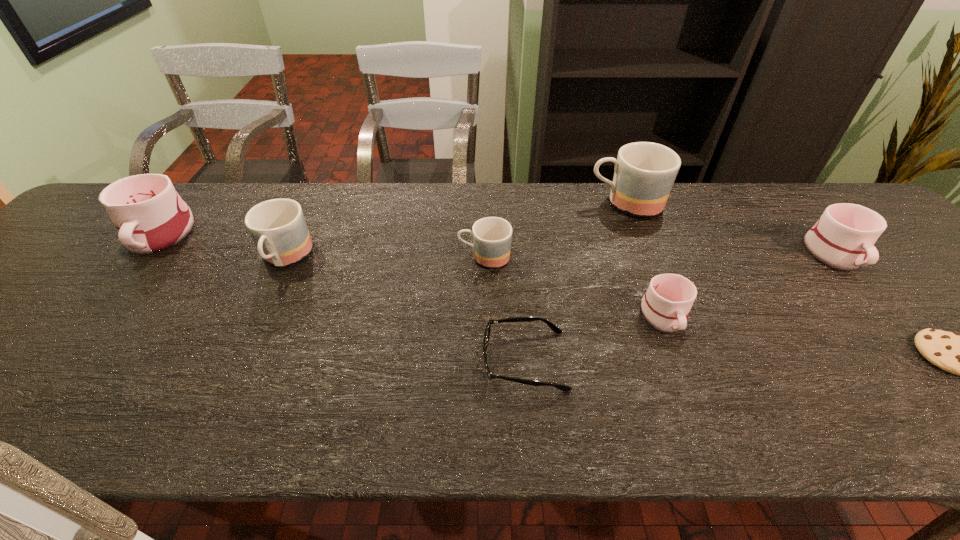
The height and width of the screenshot is (540, 960). I want to click on object that stands as the fourth closest to the second shortest object, so click(x=278, y=228).

This screenshot has height=540, width=960. Identify the location of the third closest mug to the second white mug from left to right. (843, 238).

Locate an element on the screen. The width and height of the screenshot is (960, 540). mug that stands as the fourth closest to the second smallest white mug is located at coordinates (278, 228).

Identify which blue mug is the third closest to the spectacles. Please provide its 2D coordinates. Your answer should be formatted as a tuple, i.e. [(x, y)], where the tuple contains the x and y coordinates of a point satisfying the conditions above.

[(278, 228)]

Where is `blue mug identified as the closest to the leftmost mug`? The image size is (960, 540). blue mug identified as the closest to the leftmost mug is located at coordinates pyautogui.click(x=278, y=228).

Locate an element on the screen. The width and height of the screenshot is (960, 540). white mug that stands as the closest to the biggest blue mug is located at coordinates (667, 302).

Identify which white mug is the third nearest to the smallest blue mug. Please provide its 2D coordinates. Your answer should be formatted as a tuple, i.e. [(x, y)], where the tuple contains the x and y coordinates of a point satisfying the conditions above.

[(843, 238)]